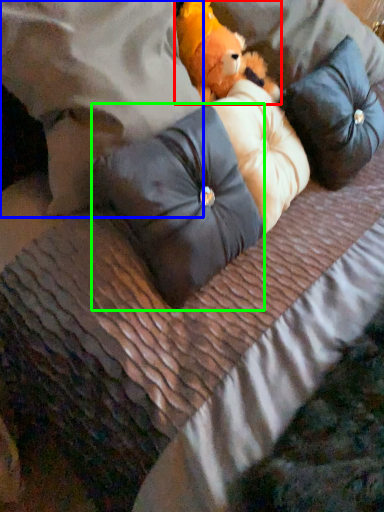
Question: Based on their relative distances, which object is nearer to teddy bear (highlighted by a red box)? Choose from pillow (highlighted by a blue box) and pillow (highlighted by a green box).

Choices:
 (A) pillow
 (B) pillow

Answer: (A)